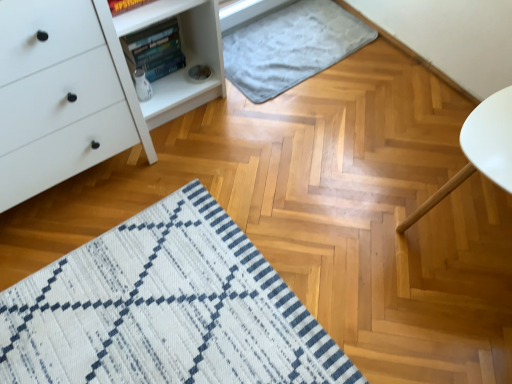
Identify the location of free location to the right of gray soft rug at upper center. The height and width of the screenshot is (384, 512). (391, 83).